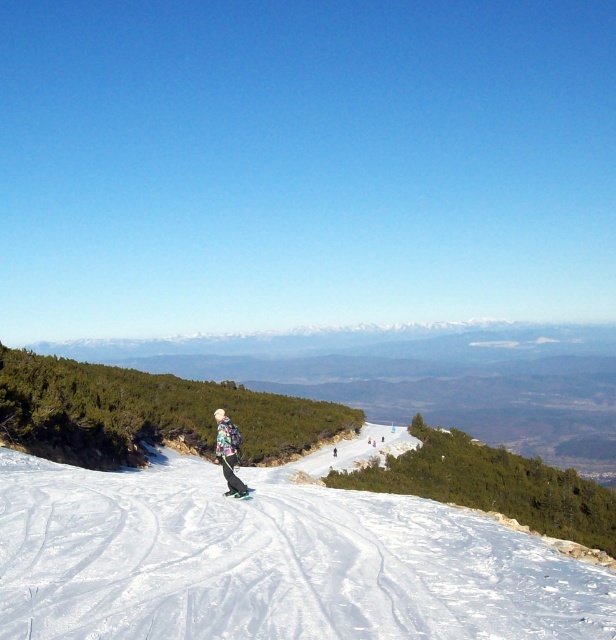
Question: Which of the following is the closest to the observer?

Choices:
 (A) multicolored snowboard at center
 (B) black matte snowboard at center

Answer: (B)

Question: Estimate the real-world distances between objects in this image. Which object is farther from the white powdery snow at center?

Choices:
 (A) black matte snowboard at center
 (B) multicolored snowboard at center

Answer: (B)

Question: Which point is closer to the camera?

Choices:
 (A) (2, 468)
 (B) (232, 496)
 (C) (227, 468)
 (D) (229, 449)

Answer: (D)

Question: Can you confirm if black matte snowboard at center is smaller than green matte ski at center?

Choices:
 (A) no
 (B) yes

Answer: (A)

Question: Is multicolored snowboard at center closer to the viewer compared to green matte ski at center?

Choices:
 (A) yes
 (B) no

Answer: (A)

Question: In this image, where is black matte snowboard at center located relative to green matte ski at center?

Choices:
 (A) right
 (B) left

Answer: (B)